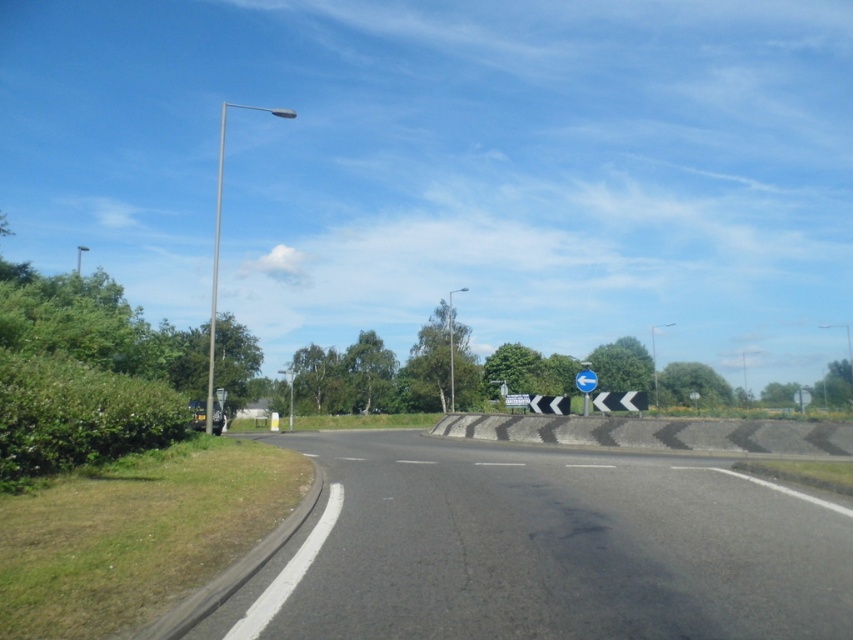
Between black asphalt highway at lower left and blue plastic sign at center, which one appears on the left side from the viewer's perspective?

From the viewer's perspective, black asphalt highway at lower left appears more on the left side.

Between point (227, 634) and point (589, 401), which one is positioned behind?

Positioned behind is point (589, 401).

The width and height of the screenshot is (853, 640). I want to click on black asphalt highway at lower left, so click(x=541, y=548).

Is point (210, 365) farther from viewer compared to point (590, 384)?

That is True.

Does metallic pole at left have a larger size compared to blue plastic sign at center?

Indeed, metallic pole at left has a larger size compared to blue plastic sign at center.

Between point (210, 365) and point (577, 372), which one is positioned in front?

Point (210, 365) is more forward.

You are a GUI agent. You are given a task and a screenshot of the screen. Output one action in this format:
    pyautogui.click(x=<x>, y=<y>)
    Task: Click on the metallic pole at left
    Image resolution: width=853 pixels, height=640 pixels.
    Given the screenshot: What is the action you would take?
    pyautogui.click(x=215, y=273)

Is blue plastic sign at center bigger than blue glossy sign at center?

Yes.

Is point (585, 381) less distant than point (585, 380)?

Yes, it is in front of point (585, 380).

Who is more distant from viewer, (587, 396) or (584, 392)?

The point (587, 396) is behind.

Locate an element on the screen. blue plastic sign at center is located at coordinates (585, 385).